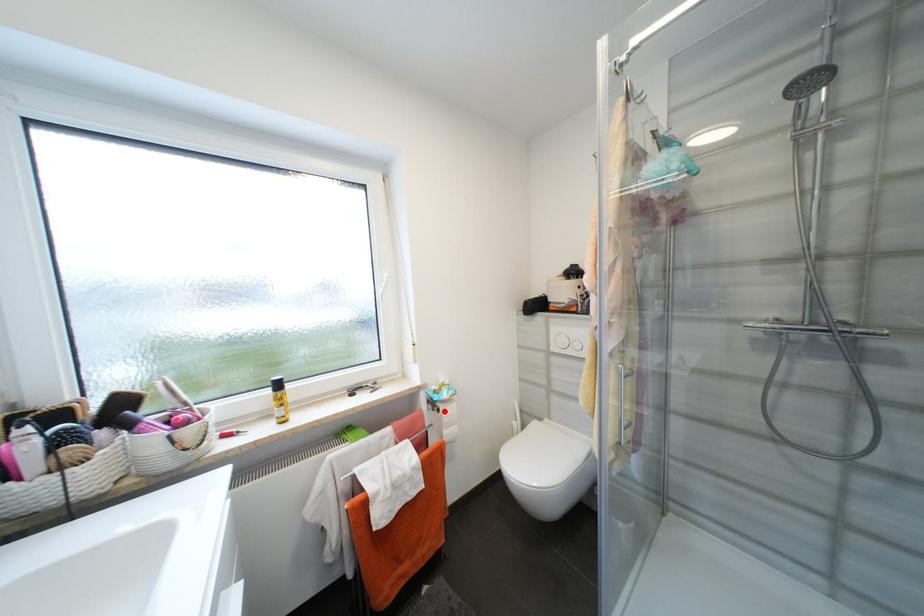
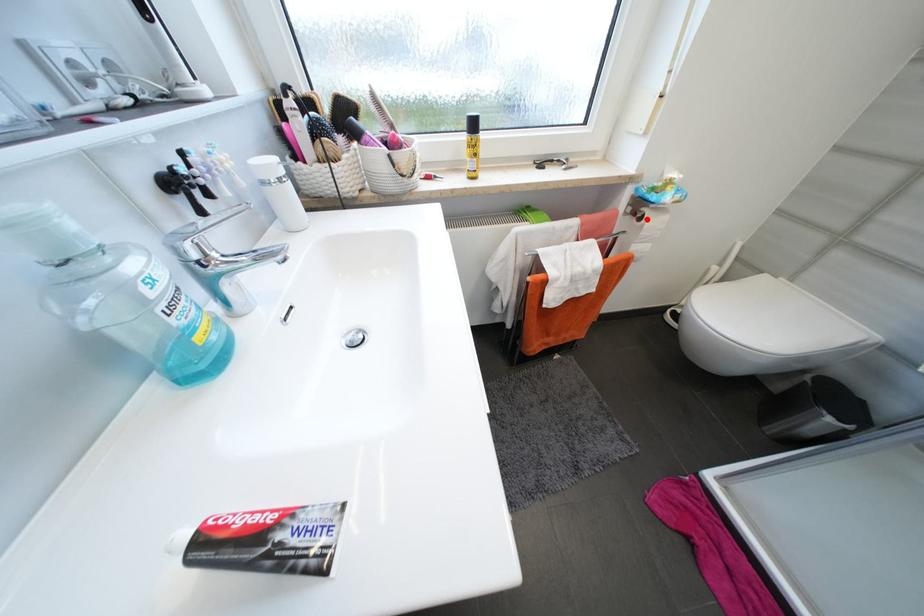
I am providing you with two images of the same scene from different viewpoints. A red point is marked on the first image and another point is marked on the second image. Is the marked point in image1 the same physical position as the marked point in image2?

Yes